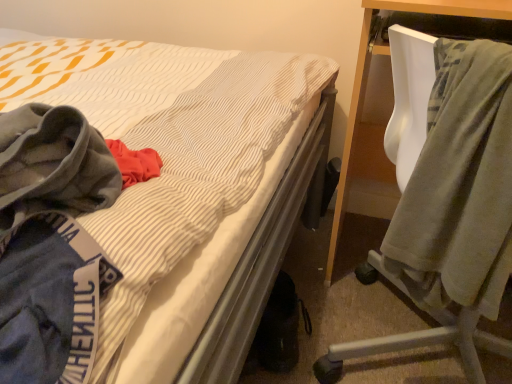
The width and height of the screenshot is (512, 384). Describe the element at coordinates (53, 164) in the screenshot. I see `gray fleece hoodie at left` at that location.

Identify the location of gray fleece hoodie at left. (53, 164).

What do you see at coordinates (409, 99) in the screenshot? I see `velvet green blanket at right` at bounding box center [409, 99].

The image size is (512, 384). Find the location of `velvet green blanket at right`. velvet green blanket at right is located at coordinates (409, 99).

Image resolution: width=512 pixels, height=384 pixels. Find the location of `gray fleece hoodie at left`. gray fleece hoodie at left is located at coordinates [x=53, y=164].

From the picture: Does velvet green blanket at right appear on the right side of gray fleece hoodie at left?

Indeed, velvet green blanket at right is positioned on the right side of gray fleece hoodie at left.

Is velvet green blanket at right positioned before gray fleece hoodie at left?

No, velvet green blanket at right is behind gray fleece hoodie at left.

Which is nearer, (490, 336) or (6, 121)?

Point (490, 336).

From the image's perspective, between velvet green blanket at right and gray fleece hoodie at left, which one is located above?

From the image's view, velvet green blanket at right is above.

From a real-world perspective, between velvet green blanket at right and gray fleece hoodie at left, who is vertically lower?

In real-world perspective, velvet green blanket at right is lower.

Looking at their sizes, would you say velvet green blanket at right is wider or thinner than gray fleece hoodie at left?

Clearly, velvet green blanket at right has more width compared to gray fleece hoodie at left.

In terms of height, does velvet green blanket at right look taller or shorter compared to gray fleece hoodie at left?

Considering their sizes, velvet green blanket at right has more height than gray fleece hoodie at left.

Considering the sizes of objects velvet green blanket at right and gray fleece hoodie at left in the image provided, who is bigger, velvet green blanket at right or gray fleece hoodie at left?

velvet green blanket at right is bigger.

Which is correct: velvet green blanket at right is inside gray fleece hoodie at left, or outside of it?

velvet green blanket at right is spatially situated outside gray fleece hoodie at left.

Is velvet green blanket at right next to gray fleece hoodie at left and touching it?

There is a gap between velvet green blanket at right and gray fleece hoodie at left.

Looking at this image, is velvet green blanket at right facing towards gray fleece hoodie at left?

No, velvet green blanket at right is not aimed at gray fleece hoodie at left.

The height and width of the screenshot is (384, 512). Find the location of `chair on the right of gray fleece hoodie at left`. chair on the right of gray fleece hoodie at left is located at coordinates (409, 99).

Consider the image. Visually, is gray fleece hoodie at left positioned to the left or to the right of velvet green blanket at right?

gray fleece hoodie at left is to the left of velvet green blanket at right.

In the image, is gray fleece hoodie at left positioned in front of or behind velvet green blanket at right?

In the image, gray fleece hoodie at left appears in front of velvet green blanket at right.

Does point (35, 138) lie behind point (412, 79)?

No.

From the image's perspective, who appears lower, gray fleece hoodie at left or velvet green blanket at right?

gray fleece hoodie at left appears lower in the image.

From a real-world perspective, which object stands above the other?

gray fleece hoodie at left.

Can you confirm if gray fleece hoodie at left is thinner than velvet green blanket at right?

Yes, gray fleece hoodie at left is thinner than velvet green blanket at right.

In terms of height, does gray fleece hoodie at left look taller or shorter compared to velvet green blanket at right?

In the image, gray fleece hoodie at left appears to be shorter than velvet green blanket at right.

Can you confirm if gray fleece hoodie at left is bigger than velvet green blanket at right?

No.

Choose the correct answer: Is gray fleece hoodie at left inside velvet green blanket at right or outside it?

gray fleece hoodie at left is spatially situated outside velvet green blanket at right.

Are gray fleece hoodie at left and velvet green blanket at right making contact?

No, gray fleece hoodie at left is not making contact with velvet green blanket at right.

Could you tell me if gray fleece hoodie at left is facing velvet green blanket at right?

No.

How many degrees apart are the facing directions of gray fleece hoodie at left and velvet green blanket at right?

0.813 degrees separate the facing orientations of gray fleece hoodie at left and velvet green blanket at right.

This screenshot has height=384, width=512. In order to click on cloak that is in front of the velvet green blanket at right in this screenshot , I will do `click(53, 164)`.

Image resolution: width=512 pixels, height=384 pixels. Identify the location of cloak positioned vertically above the velvet green blanket at right (from a real-world perspective). (53, 164).

At what (x,y) coordinates should I click in order to perform the action: click on cloak in front of the velvet green blanket at right. Please return your answer as a coordinate pair (x, y). The width and height of the screenshot is (512, 384). Looking at the image, I should click on (53, 164).